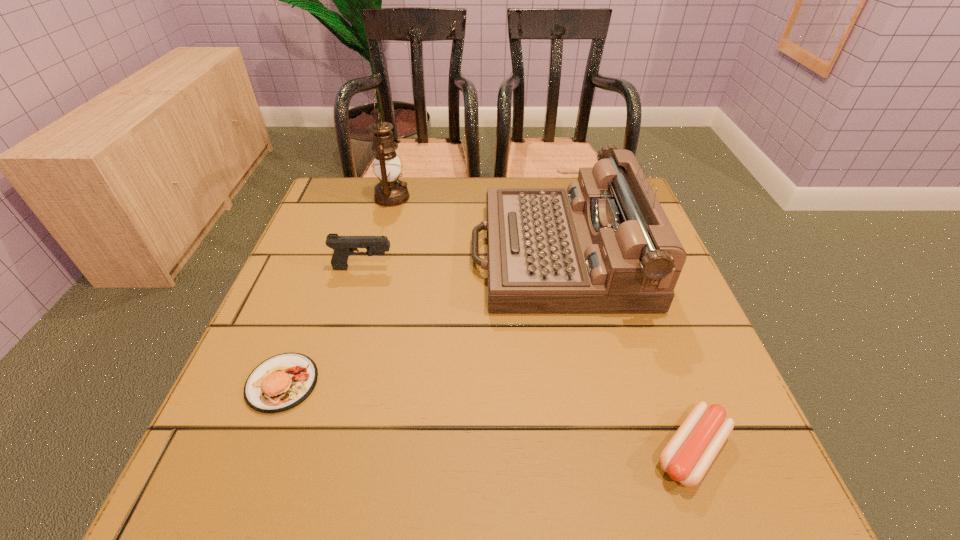
In order to click on object present at the far left corner in this screenshot , I will do `click(390, 192)`.

Locate an element on the screen. The image size is (960, 540). object that is at the far right corner is located at coordinates (604, 245).

The height and width of the screenshot is (540, 960). In order to click on object present at the near right corner in this screenshot , I will do `click(688, 455)`.

The image size is (960, 540). I want to click on vacant space at the far edge, so click(x=466, y=177).

You are a GUI agent. You are given a task and a screenshot of the screen. Output one action in this format:
    pyautogui.click(x=<x>, y=<y>)
    Task: Click on the free space at the near edge of the desktop
    The height and width of the screenshot is (540, 960).
    Given the screenshot: What is the action you would take?
    pyautogui.click(x=314, y=496)

The width and height of the screenshot is (960, 540). In order to click on free region at the left edge of the desktop in this screenshot , I will do `click(241, 414)`.

The width and height of the screenshot is (960, 540). Find the location of `blank area at the far left corner`. blank area at the far left corner is located at coordinates (324, 222).

The width and height of the screenshot is (960, 540). Identify the location of free space at the near right corner of the desktop. (661, 476).

What are the coordinates of `free space between the second shortest object and the third tallest object` in the screenshot? It's located at (323, 326).

Find the location of a particular element. Image resolution: width=960 pixels, height=540 pixels. unoccupied area between the sausage and the oil lamp is located at coordinates (541, 324).